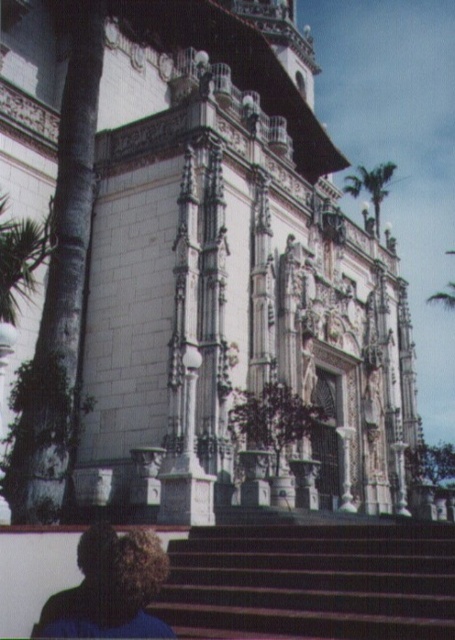
Does brown wooden stairs at lower center lie in front of dark curly hair at lower left?

That is True.

Between point (288, 582) and point (121, 544), which one is positioned behind?

The point (288, 582) is more distant.

I want to click on brown wooden stairs at lower center, so click(313, 580).

Is dark curly hair at lower left closer to the viewer compared to green leafy palm tree at upper right?

Yes, dark curly hair at lower left is in front of green leafy palm tree at upper right.

The width and height of the screenshot is (455, 640). In order to click on dark curly hair at lower left in this screenshot , I will do `click(110, 588)`.

Does brown wooden stairs at lower center have a greater height compared to green leafy palm tree at upper right?

No, brown wooden stairs at lower center is not taller than green leafy palm tree at upper right.

Is brown wooden stairs at lower center to the left of green leafy palm tree at upper right from the viewer's perspective?

Yes, brown wooden stairs at lower center is to the left of green leafy palm tree at upper right.

Is point (273, 596) positioned after point (374, 204)?

No, (273, 596) is in front of (374, 204).

Find the location of a particular element. brown wooden stairs at lower center is located at coordinates (313, 580).